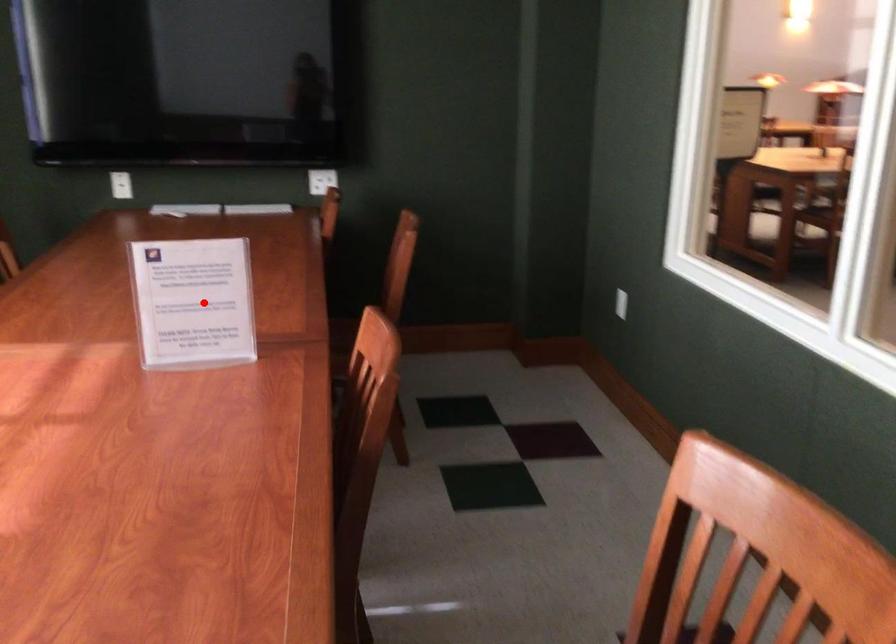
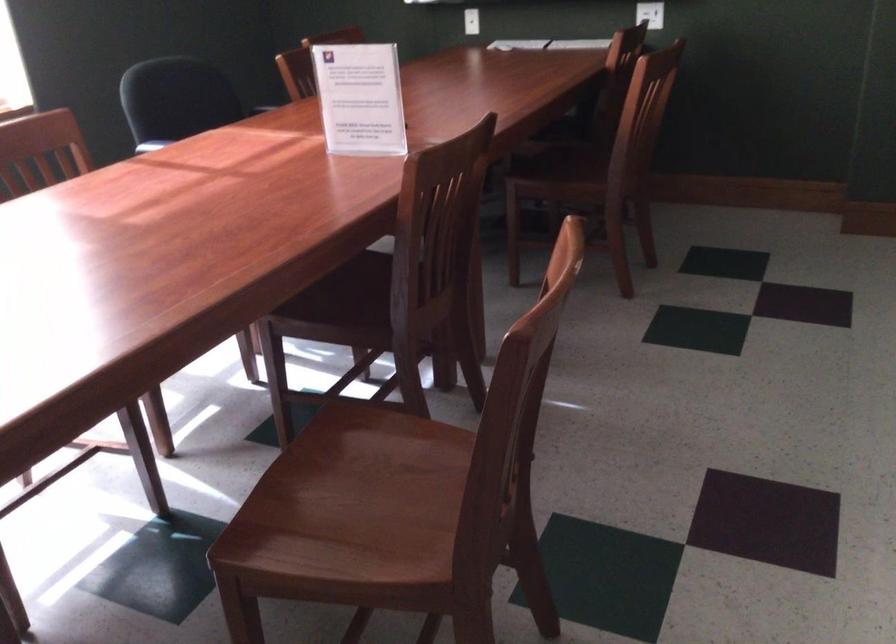
Question: I am providing you with two images of the same scene from different viewpoints. A red point is shown in image1. For the corresponding object point in image2, is it positioned nearer or farther from the camera?

Choices:
 (A) Nearer
 (B) Farther

Answer: (B)